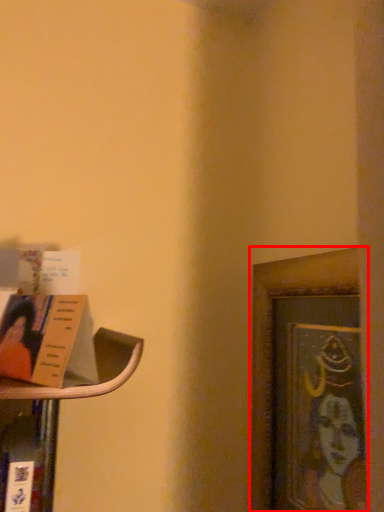
Question: In this image, where is picture frame (annotated by the red box) located relative to book?

Choices:
 (A) left
 (B) right

Answer: (B)